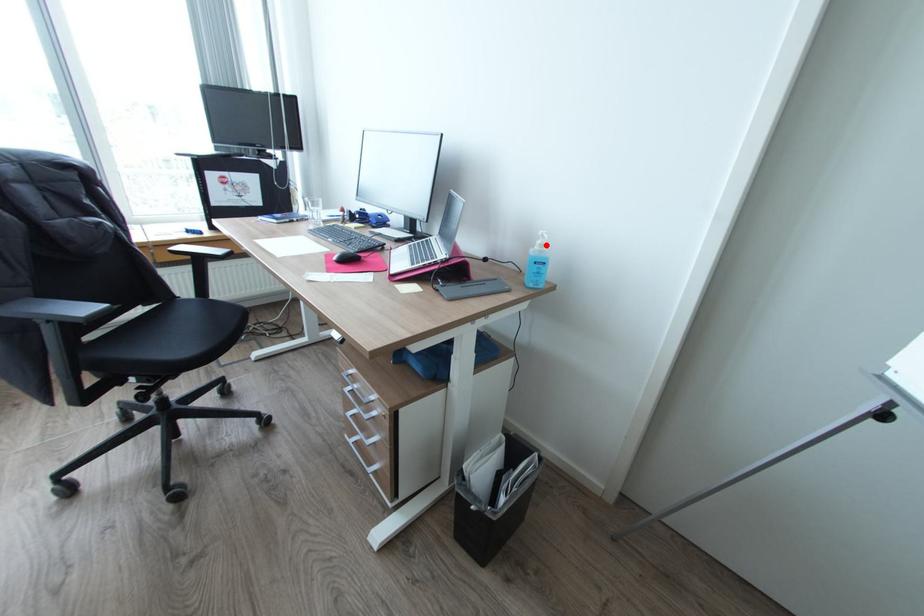
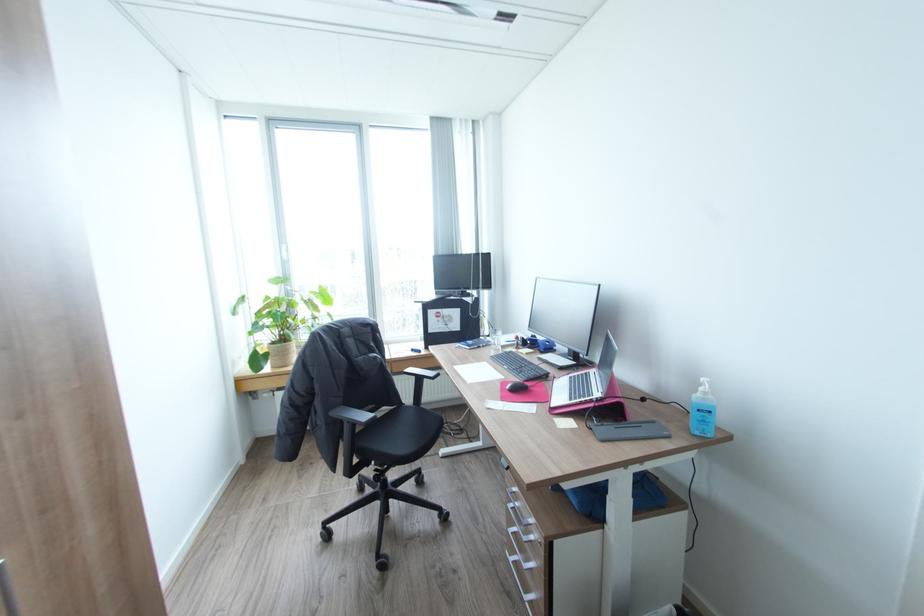
Where in the second image is the point corresponding to the highlighted location from the first image?

(710, 392)